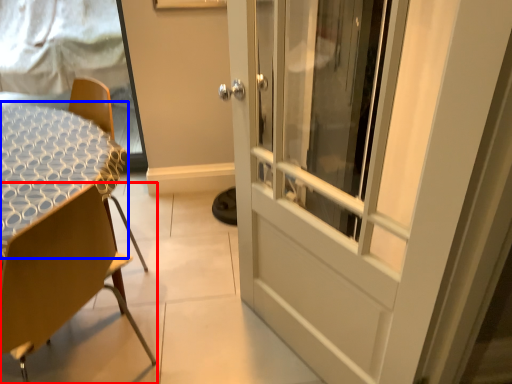
Question: Which point is further to the camera, chair (highlighted by a red box) or round table (highlighted by a blue box)?

Choices:
 (A) chair
 (B) round table

Answer: (B)